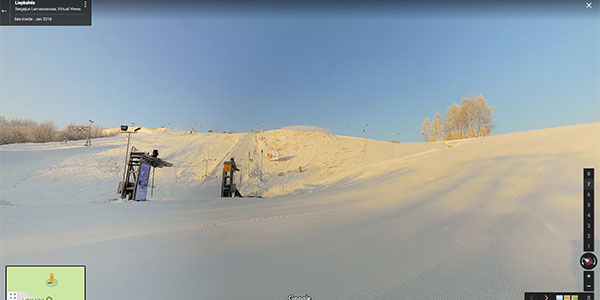
Identify the location of lights. (89, 123).